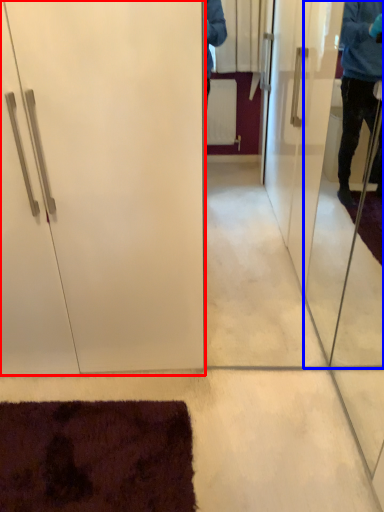
Question: Which of the following is the closest to the observer, door (highlighted by a red box) or screen door (highlighted by a blue box)?

Choices:
 (A) door
 (B) screen door

Answer: (B)